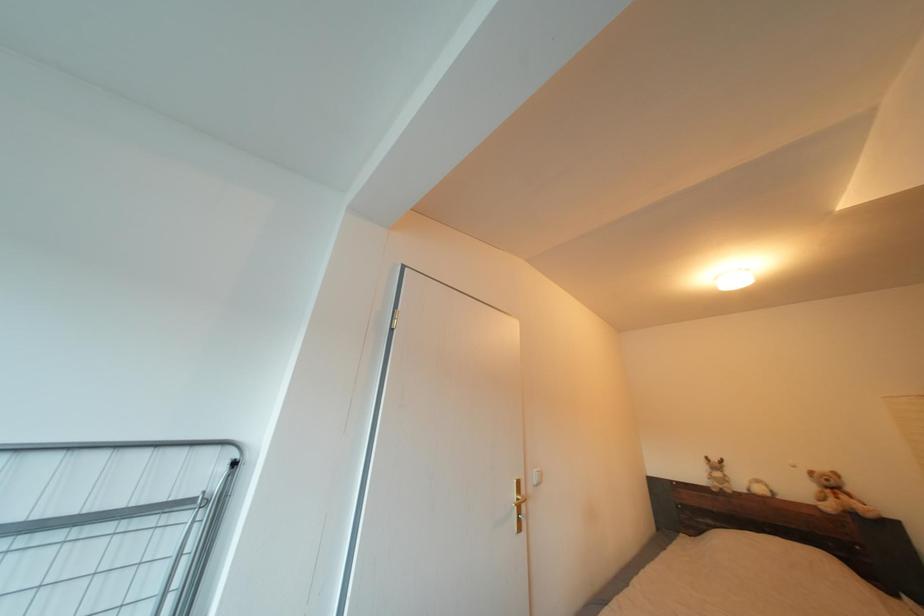
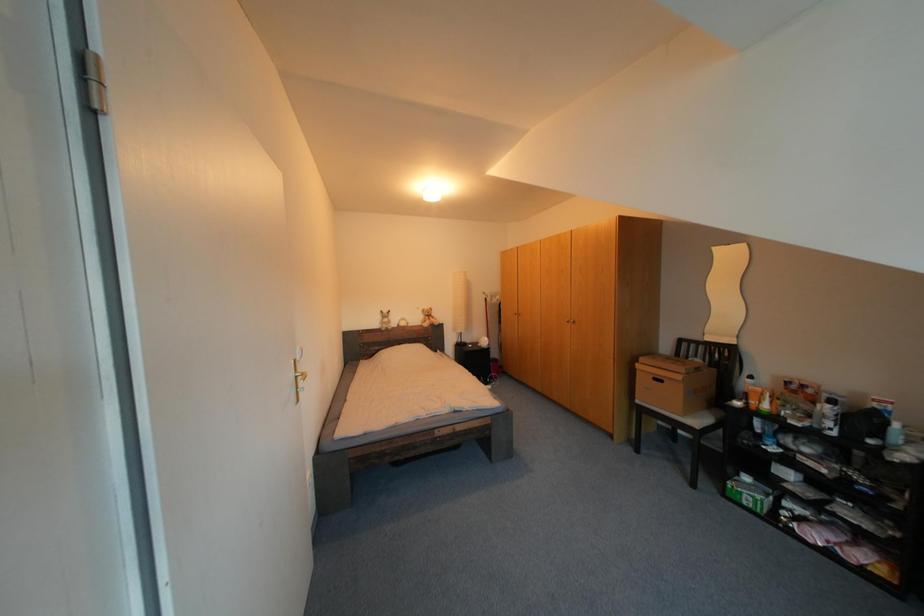
Based on the photo, the first image is from the beginning of the video and the second image is from the end. How did the camera likely rotate when shooting the video?

The camera's rotation is toward right-down.